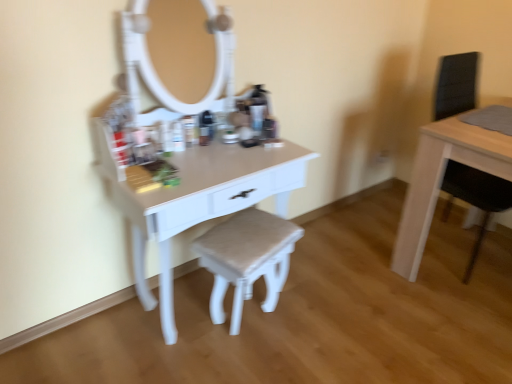
Find the location of `free location in front of matte white stool at center`. free location in front of matte white stool at center is located at coordinates (250, 364).